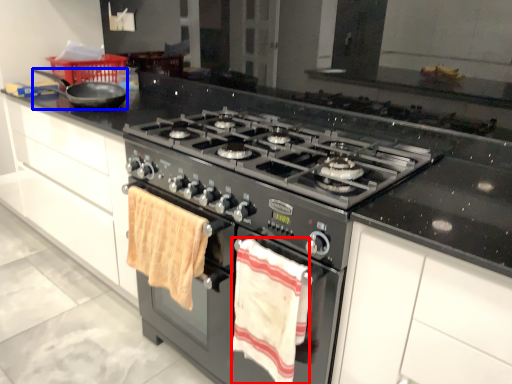
Question: Which of the following is the farthest to the observer, beach towel (highlighted by a red box) or frying pan (highlighted by a blue box)?

Choices:
 (A) beach towel
 (B) frying pan

Answer: (B)